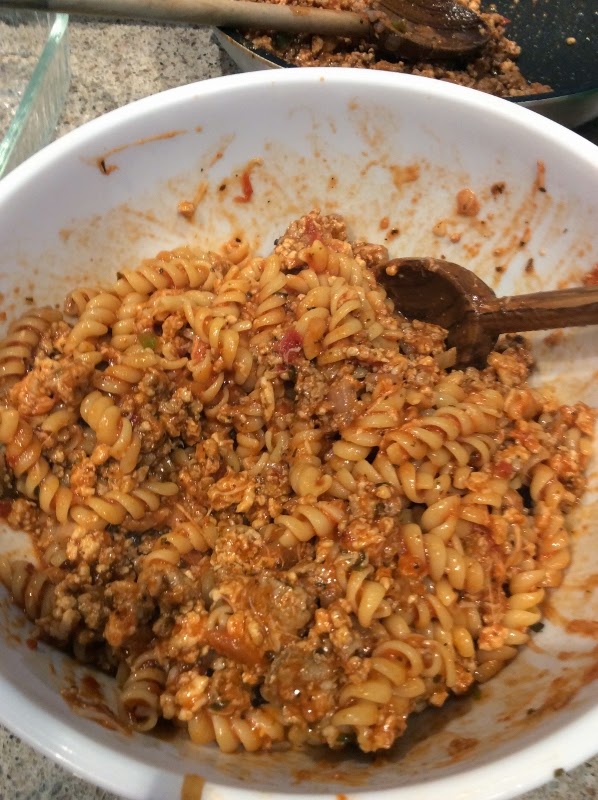
The width and height of the screenshot is (598, 800). In order to click on countertop in this screenshot , I will do `click(44, 780)`, `click(573, 785)`, `click(134, 65)`.